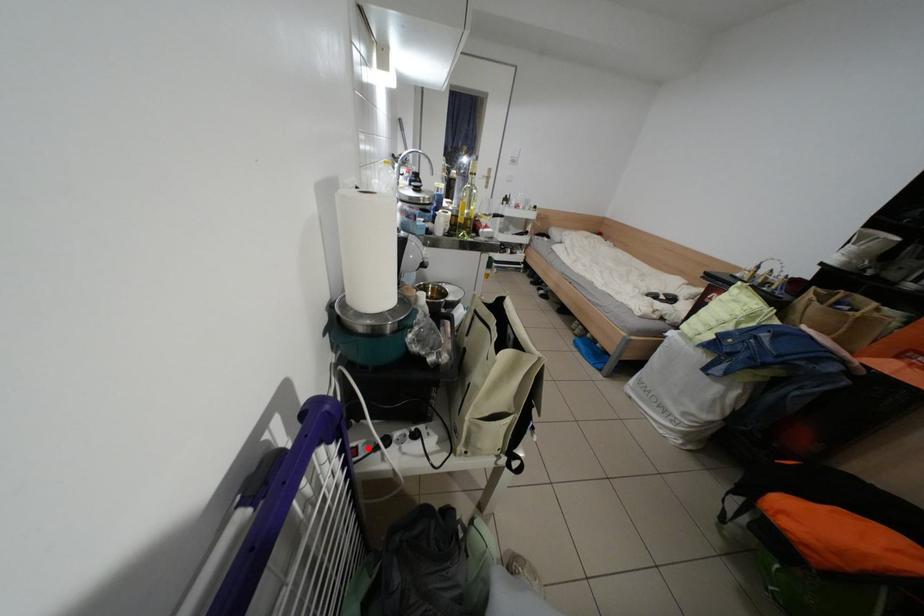
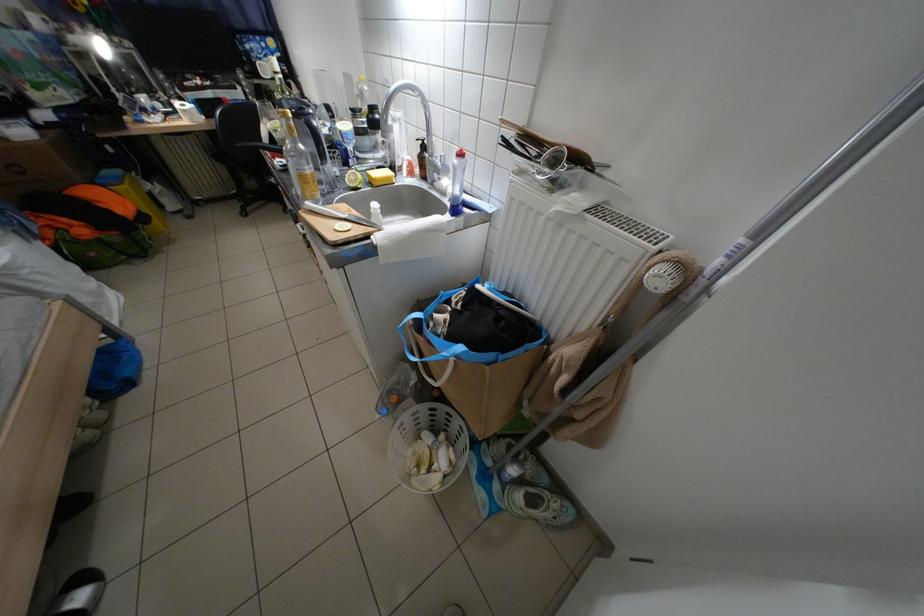
Question: I am providing you with two images of the same scene from different viewpoints. A red point is marked on the first image. At the location where the point appears in image 1, is it still visible in image 2?

Choices:
 (A) Yes
 (B) No

Answer: (B)